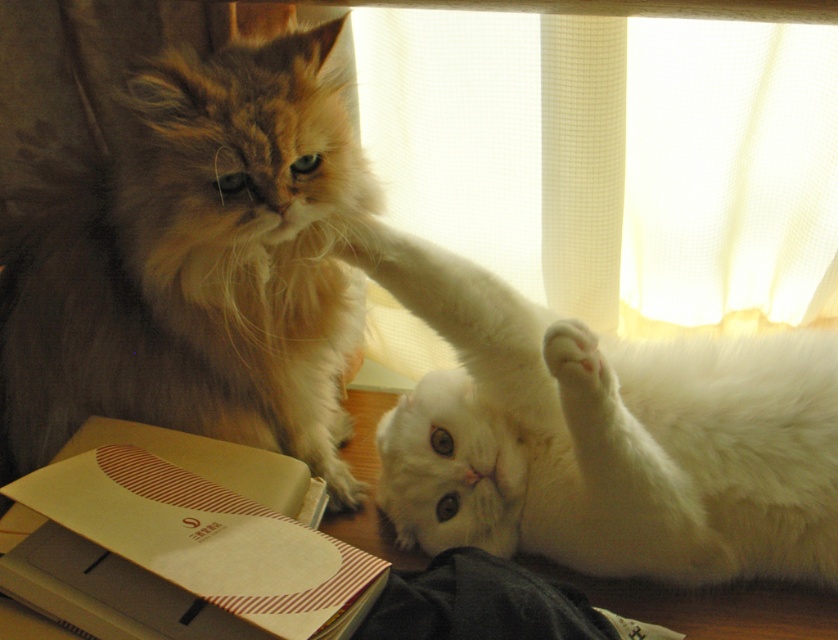
Which of these two, fluffy brown cat at left or white fluffy cat at lower right, stands taller?

fluffy brown cat at left

Between point (290, 212) and point (464, 403), which one is positioned behind?

The point (464, 403) is more distant.

This screenshot has width=838, height=640. What do you see at coordinates (194, 264) in the screenshot? I see `fluffy brown cat at left` at bounding box center [194, 264].

Image resolution: width=838 pixels, height=640 pixels. I want to click on fluffy brown cat at left, so click(x=194, y=264).

Is white fluffy cat at lower right below white fluffy paw at lower right?

Correct, white fluffy cat at lower right is located below white fluffy paw at lower right.

Image resolution: width=838 pixels, height=640 pixels. What are the coordinates of `white fluffy cat at lower right` in the screenshot? It's located at (604, 440).

Is fluffy brown cat at left to the left of white sheer curtain at upper center from the viewer's perspective?

Indeed, fluffy brown cat at left is positioned on the left side of white sheer curtain at upper center.

Is fluffy brown cat at left above white sheer curtain at upper center?

Actually, fluffy brown cat at left is below white sheer curtain at upper center.

Measure the distance between fluffy brown cat at left and camera.

fluffy brown cat at left and camera are 1.04 meters apart.

This screenshot has height=640, width=838. Find the location of `fluffy brown cat at left`. fluffy brown cat at left is located at coordinates (194, 264).